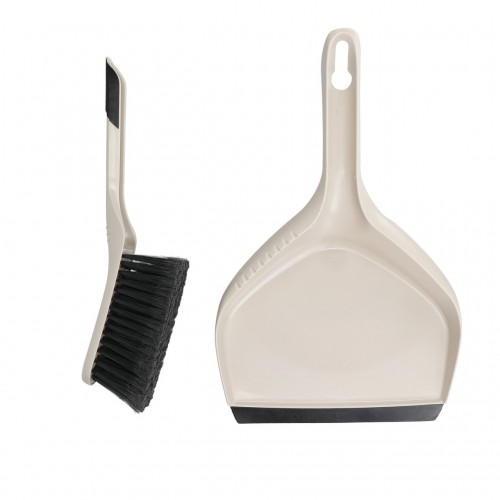
Identify the location of beige dust pan. The image size is (500, 500). (370, 347).